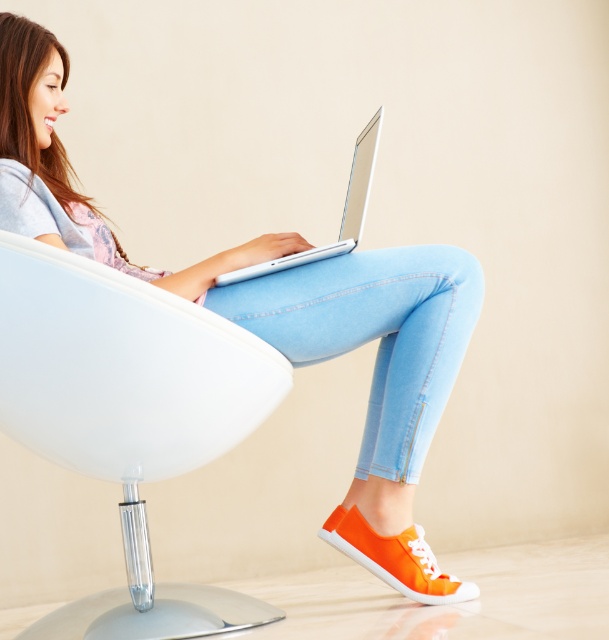
You are standing in front of the chair and want to place a small book on the silver metallic laptop at center. Can you reach the laptop without moving the white plastic swivel chair at center?

The white plastic swivel chair at center is closer to the viewer than the silver metallic laptop at center, so you would need to move closer to reach the laptop.

You are taking a photo of the scene and want to focus on the point at coordinates point (304, 246) and point (77, 468). Which point should you focus on first to ensure both are in focus?

Point (304, 246) is further to the camera than point (77, 468). To ensure both points are in focus, focus on the closer point first, which is point (77, 468).

You are a photographer setting up a shot of the person in the egg chair. The matte white laptop at center is crucial to the composition. Where should you position your camera to ensure the laptop is centered in the frame?

To center the matte white laptop at center in the frame, position the camera at point 0.489 on the x axis and 0.456 on the y axis, as the laptop is located at those coordinates.